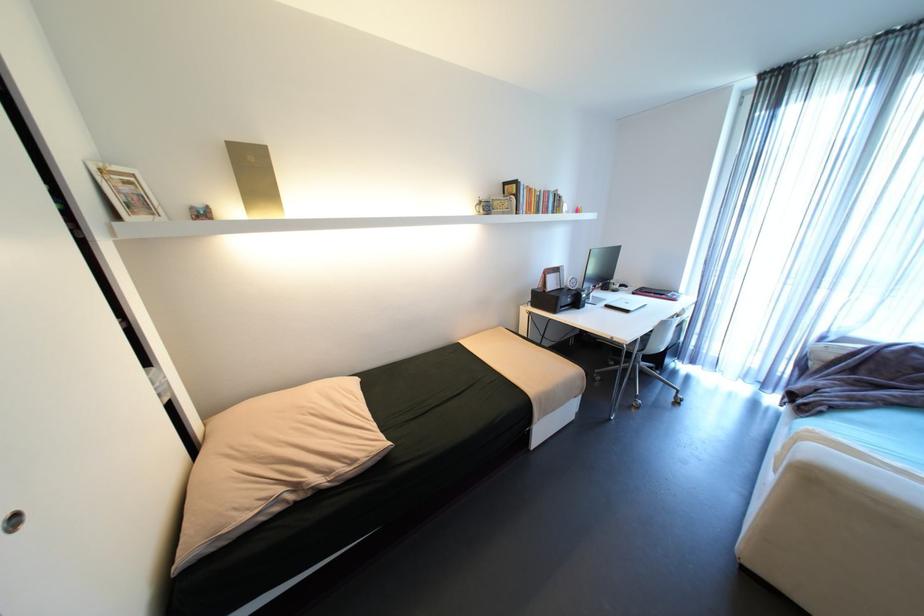
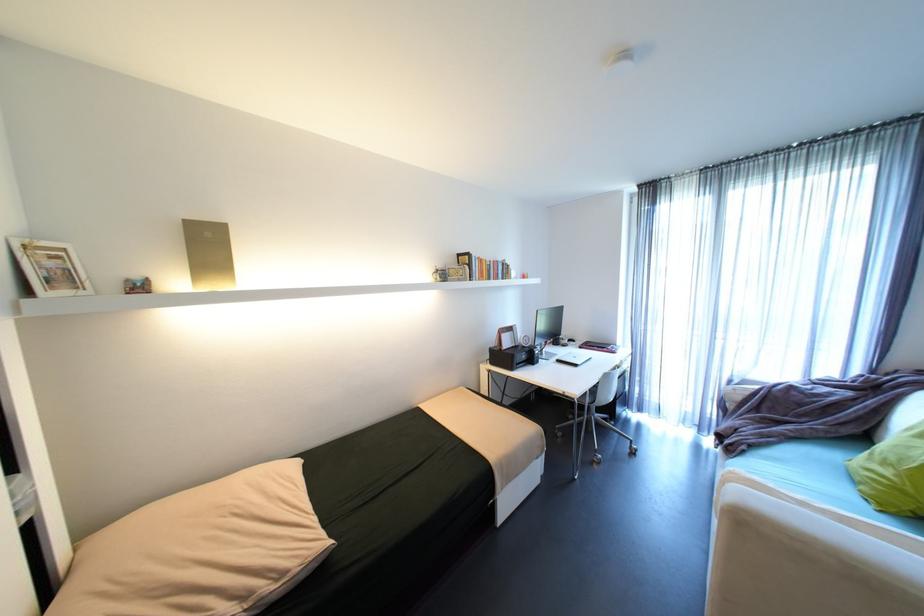
Locate, in the second image, the point that corresponds to (830,411) in the first image.

(751, 451)